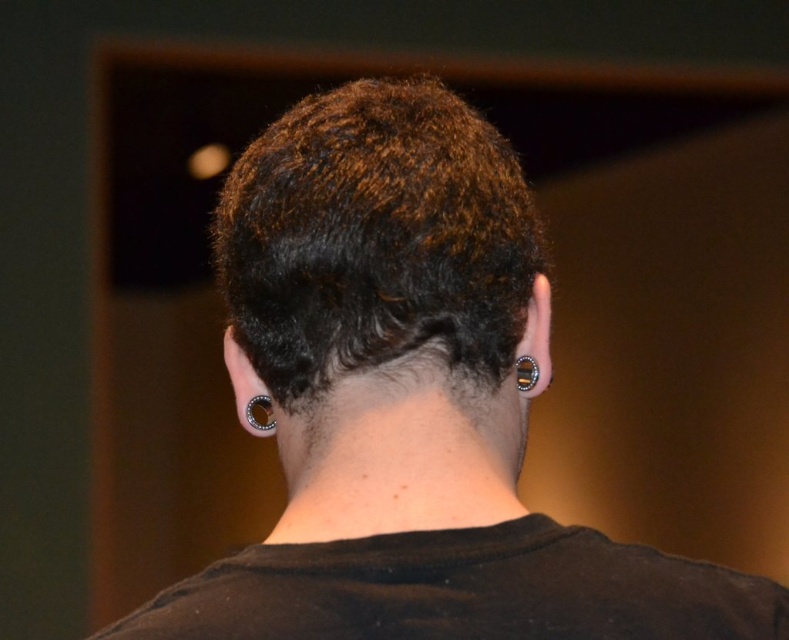
Looking at this image, you are standing in a room with the person shown. The point at coordinates point (485, 269) is part of their body. If you want to hand them a small gift card without touching their hair, which part of their body should you aim for?

The point at coordinates point (485, 269) is 24.83 inches away from the viewer, so you should aim for that point to place the gift card without touching their hair.